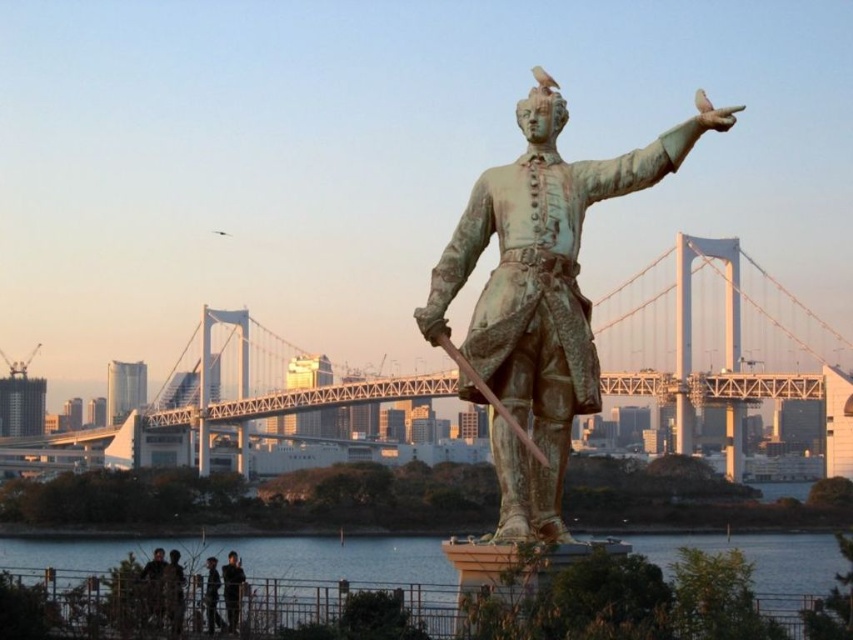
Is point (173, 609) less distant than point (212, 577)?

Yes.

Is camouflage fabric person at lower center bigger than dark gray fabric jacket at lower center?

Yes, camouflage fabric person at lower center is bigger than dark gray fabric jacket at lower center.

This screenshot has height=640, width=853. Describe the element at coordinates (173, 593) in the screenshot. I see `camouflage fabric person at lower center` at that location.

Locate an element on the screen. This screenshot has width=853, height=640. camouflage fabric person at lower center is located at coordinates (173, 593).

Between bronze statue at center and dark gray fabric jacket at lower center, which one is positioned higher?

bronze statue at center is higher up.

The width and height of the screenshot is (853, 640). What are the coordinates of `bronze statue at center` in the screenshot? It's located at (538, 296).

Who is lower down, camouflage fabric person at lower center or dark brown leather jacket at lower left?

camouflage fabric person at lower center is below.

Could you measure the distance between camouflage fabric person at lower center and dark brown leather jacket at lower left?

camouflage fabric person at lower center is 2.34 meters away from dark brown leather jacket at lower left.

This screenshot has height=640, width=853. Describe the element at coordinates (173, 593) in the screenshot. I see `camouflage fabric person at lower center` at that location.

What are the coordinates of `camouflage fabric person at lower center` in the screenshot? It's located at (173, 593).